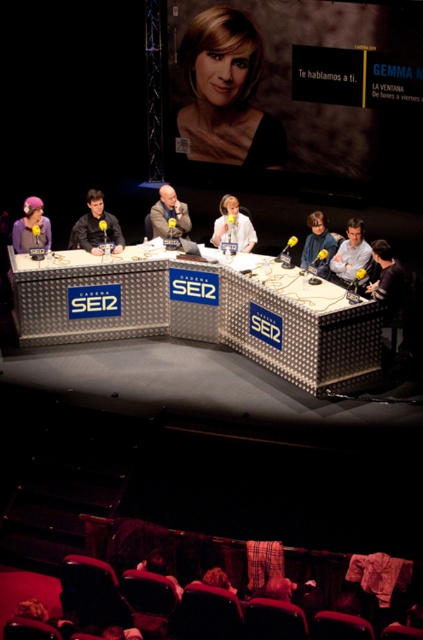
Question: Among these points, which one is farthest from the camera?

Choices:
 (A) (22, 234)
 (B) (329, 237)

Answer: (A)

Question: Is matte gray shirt at center smaller than matte black microphone at center?

Choices:
 (A) yes
 (B) no

Answer: (A)

Question: Estimate the real-world distances between objects in this image. Which object is farther from the matte gray shirt at center?

Choices:
 (A) metallic mesh table at center
 (B) matte purple wig at left

Answer: (B)

Question: Which point is closer to the camera?

Choices:
 (A) (98, 205)
 (B) (35, 202)
 (C) (326, 275)

Answer: (C)

Question: Can you confirm if matte gray shirt at center is positioned to the left of matte black microphone at center?

Choices:
 (A) no
 (B) yes

Answer: (A)

Question: Does matte gray shirt at center appear under matte purple wig at left?

Choices:
 (A) yes
 (B) no

Answer: (A)